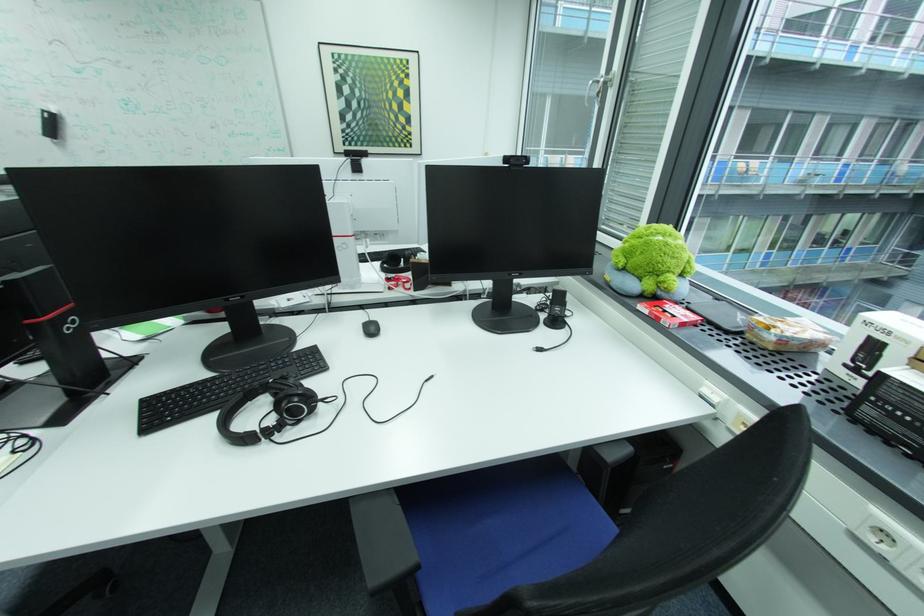
You are a GUI agent. You are given a task and a screenshot of the screen. Output one action in this format:
    pyautogui.click(x=<x>, y=<y>)
    Task: Click on the white cardboard box
    The image size is (924, 616).
    Given the screenshot: What is the action you would take?
    pyautogui.click(x=874, y=345)